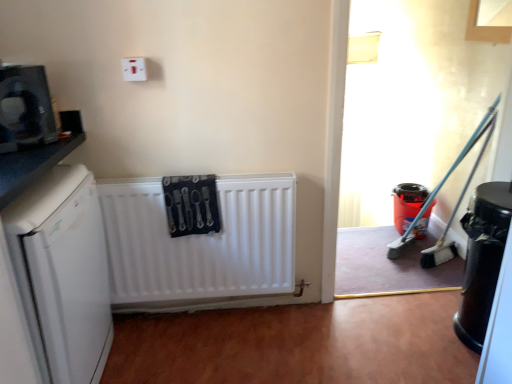
Question: Would you say white matte dishwasher at left is inside or outside matte black microwave at upper left, which is the first appliance in left-to-right order?

Choices:
 (A) inside
 (B) outside

Answer: (B)

Question: Does point (3, 218) appear closer or farther from the camera than point (27, 102)?

Choices:
 (A) closer
 (B) farther

Answer: (A)

Question: Which of these objects is positioned closest to the white plastic electric outlet at upper center?

Choices:
 (A) white matte dishwasher at left
 (B) black glossy trash can at lower right, acting as the second appliance starting from the left
 (C) matte black microwave at upper left, the third appliance from the back
 (D) matte plastic bucket at right, the 3th appliance positioned from the left
 (E) white matte radiator at center

Answer: (C)

Question: Which of these objects is positioned farthest from the white matte dishwasher at left?

Choices:
 (A) matte black microwave at upper left, the first appliance when ordered from front to back
 (B) white matte radiator at center
 (C) white plastic electric outlet at upper center
 (D) black glossy trash can at lower right, the 2th appliance positioned from the right
 (E) matte plastic bucket at right, marked as the first appliance in a right-to-left arrangement

Answer: (E)